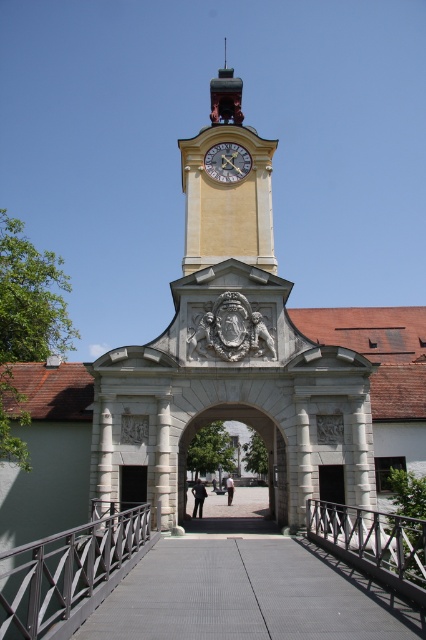
Question: Which of the following is the farthest from the observer?

Choices:
 (A) metallic gray rail at center
 (B) smooth concrete path at center
 (C) white stone archway at center

Answer: (C)

Question: Does yellow painted clock tower at upper center appear under white stone archway at center?

Choices:
 (A) yes
 (B) no

Answer: (B)

Question: Among these objects, which one is farthest from the camera?

Choices:
 (A) metallic spire at upper center
 (B) smooth concrete path at center
 (C) yellow stone clock tower at center
 (D) metallic gray rail at center

Answer: (A)

Question: Can you confirm if smooth concrete path at center is positioned below yellow painted clock tower at upper center?

Choices:
 (A) yes
 (B) no

Answer: (A)

Question: Can you confirm if yellow painted clock tower at upper center is thinner than white stone archway at center?

Choices:
 (A) yes
 (B) no

Answer: (B)

Question: Which of the following is the closest to the observer?

Choices:
 (A) (100, 580)
 (B) (227, 161)
 (C) (204, 371)
 (D) (255, 150)

Answer: (A)